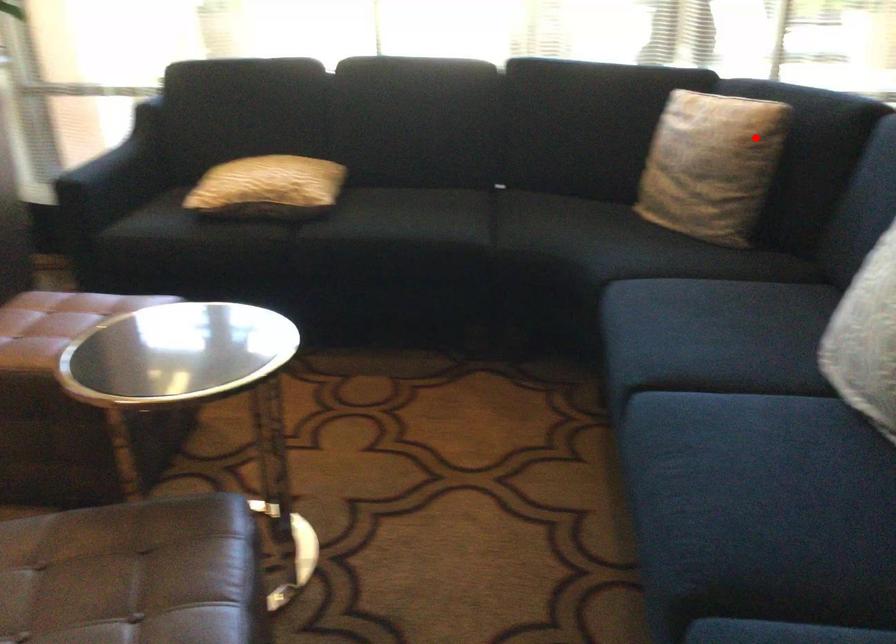
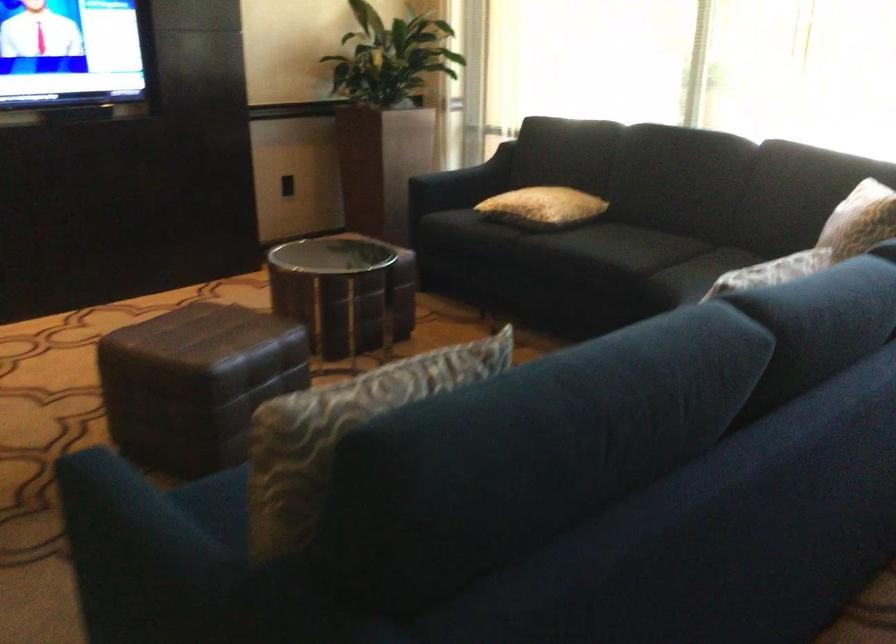
Find the pixel in the second image that matches the highlighted location in the first image.

(859, 220)